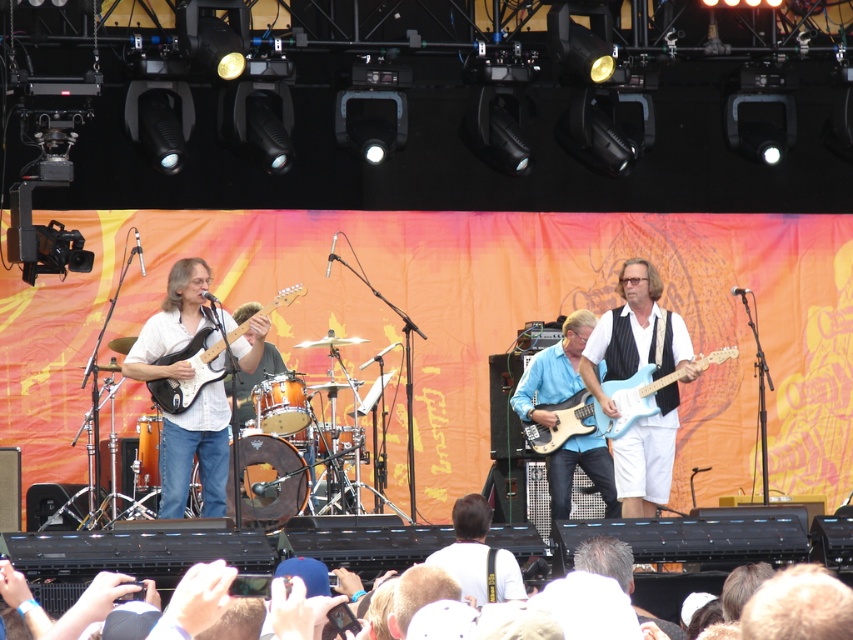
You are a photographer positioned at the back of the stage. You want to take a photo that includes both the white fabric shirt at center and the matte black electric guitar at left. Based on their positions, which object should you focus on first to ensure both are in frame?

The white fabric shirt at center is to the right of the matte black electric guitar at left. To include both in the frame, focus on the matte black electric guitar at left first as it is positioned further left, allowing the photographer to adjust the camera to capture both objects from left to right.

You are a photographer standing at the front of the stage. You notice two points marked on the stage floor at coordinates point (x=668, y=412) and point (x=590, y=323). Which point is closer to your position?

Point (x=668, y=412) is closer to the viewer than point (x=590, y=323), so the photographer would be closer to point (x=668, y=412).

You are a photographer positioned at the back of the venue. You need to capture a clear photo of the white fabric shirt at center and the matte black electric guitar at left. Based on their heights, which object will appear smaller in the photo?

The white fabric shirt at center is shorter than the matte black electric guitar at left, so it will appear smaller in the photo.